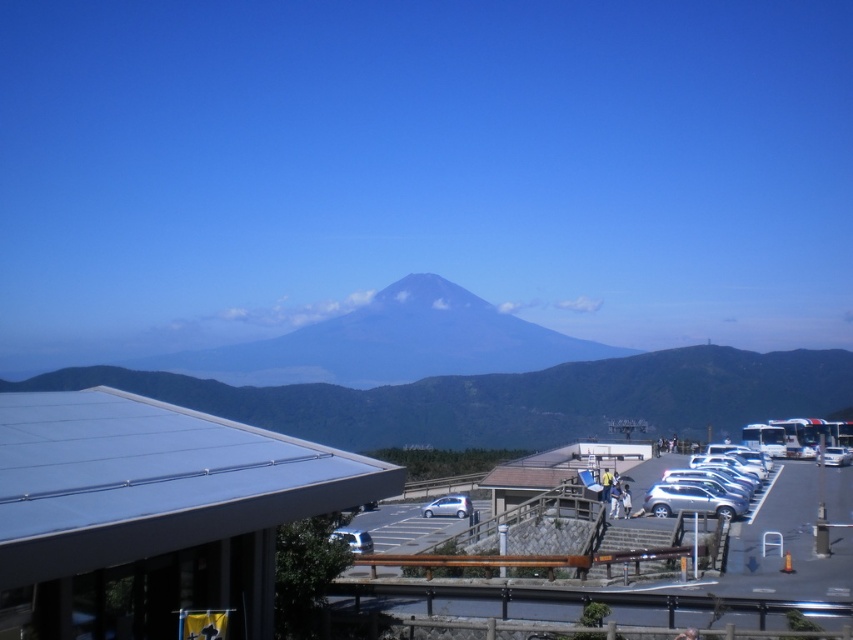
You are a tour guide explaining the parking lot layout to visitors. You point out two vehicles in the image. Which of the two vehicles, the silver metallic suv at right or the silver metallic car at center, is taller?

The silver metallic suv at right is taller than the silver metallic car at center.